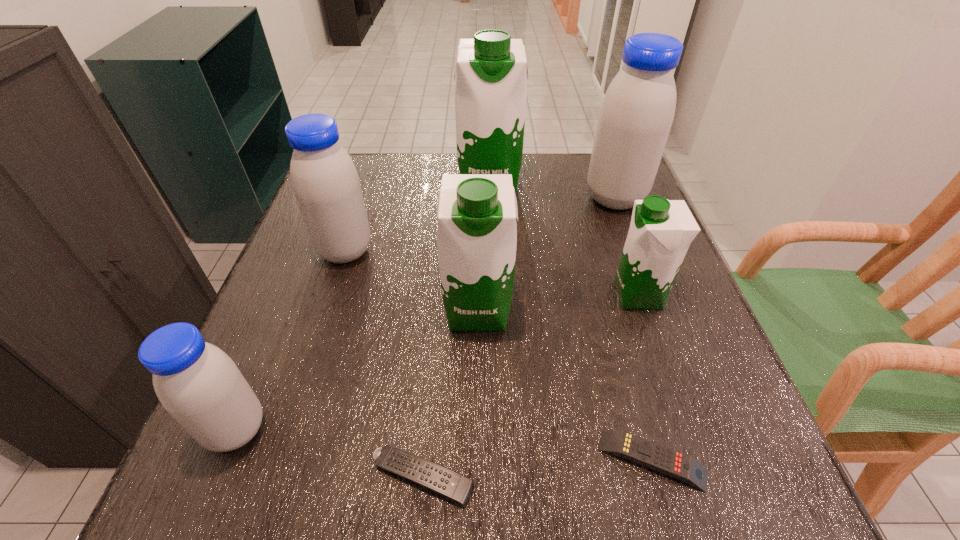
Find the location of `vacant space located on the right of the left remote control`. vacant space located on the right of the left remote control is located at coordinates pyautogui.click(x=697, y=477).

This screenshot has height=540, width=960. In order to click on soya milk located in the near edge section of the desktop in this screenshot , I will do pos(196,382).

This screenshot has height=540, width=960. Identify the location of remote control that is at the right edge. (652, 455).

Identify the location of object that is at the near left corner. The width and height of the screenshot is (960, 540). point(196,382).

Locate an element on the screen. This screenshot has height=540, width=960. object that is positioned at the far right corner is located at coordinates (637, 112).

The height and width of the screenshot is (540, 960). I want to click on object that is at the near right corner, so click(652, 455).

The width and height of the screenshot is (960, 540). Identify the location of vacant space at the near edge. (512, 500).

In the image, there is a desktop. Find the location of `vacant space at the left edge`. vacant space at the left edge is located at coordinates (276, 421).

I want to click on vacant region at the right edge of the desktop, so click(x=684, y=328).

Find the location of `free space at the near left corner`. free space at the near left corner is located at coordinates pyautogui.click(x=235, y=510).